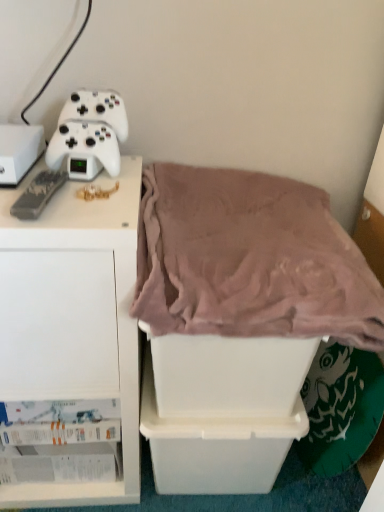
Question: From their relative heights in the image, would you say white plastic storage box at left, arranged as the 1th storage box when viewed from the top, is taller or shorter than white plastic storage box at center, which is counted as the first storage box, starting from the right?

Choices:
 (A) short
 (B) tall

Answer: (A)

Question: Does point (33, 158) appear closer or farther from the camera than point (269, 415)?

Choices:
 (A) farther
 (B) closer

Answer: (B)

Question: Considering the real-world distances, which object is closest to the black matte game controller at left, which is counted as the first game controller, starting from the bottom?

Choices:
 (A) white plastic storage box at lower center, the 2th storage box when ordered from left to right
 (B) white matte cabinet at left
 (C) white matte game controller at upper left, the 2th game controller in the front-to-back sequence
 (D) white plastic storage box at left, arranged as the 1th storage box when viewed from the top
 (E) white plastic storage box at center, marked as the 2th storage box in a bottom-to-top arrangement

Answer: (D)

Question: Considering the real-world distances, which object is farthest from the mauve plush blanket at center?

Choices:
 (A) white plastic storage box at left, which appears as the 3th storage box when ordered from the bottom
 (B) black matte game controller at left, marked as the second game controller in a top-to-bottom arrangement
 (C) white matte game controller at upper left, placed as the 1th game controller when sorted from top to bottom
 (D) white matte cabinet at left
 (E) white plastic storage box at center, marked as the 2th storage box in a bottom-to-top arrangement

Answer: (A)